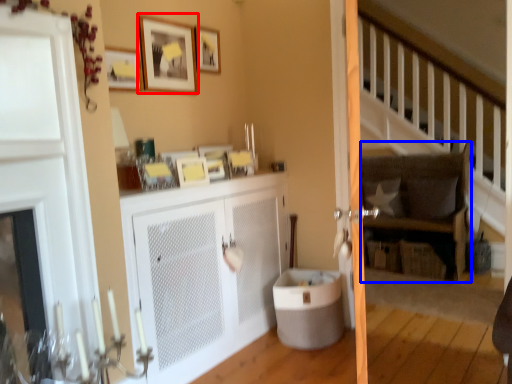
Question: Which point is closer to the camera, picture frame (highlighted by a red box) or rocking chair (highlighted by a blue box)?

Choices:
 (A) picture frame
 (B) rocking chair

Answer: (A)